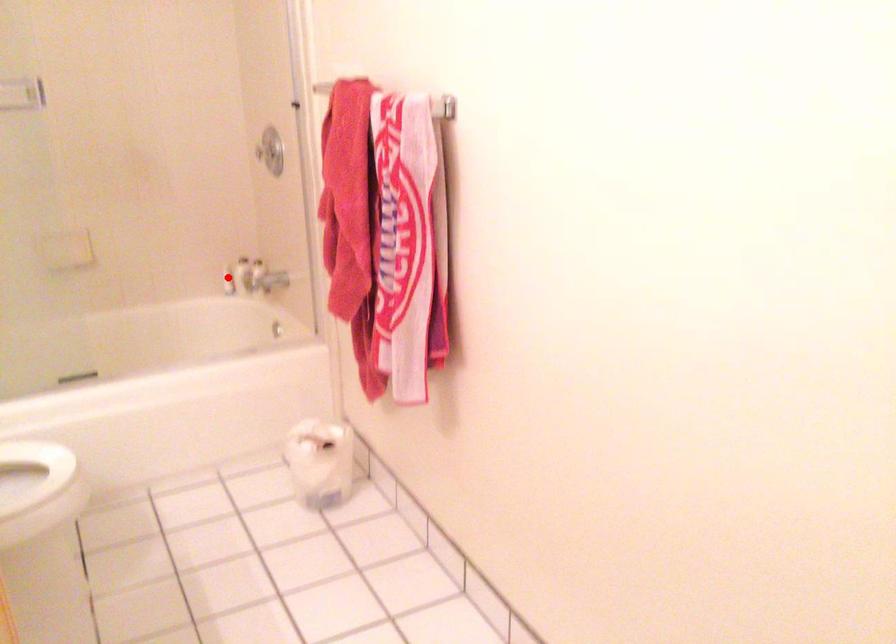
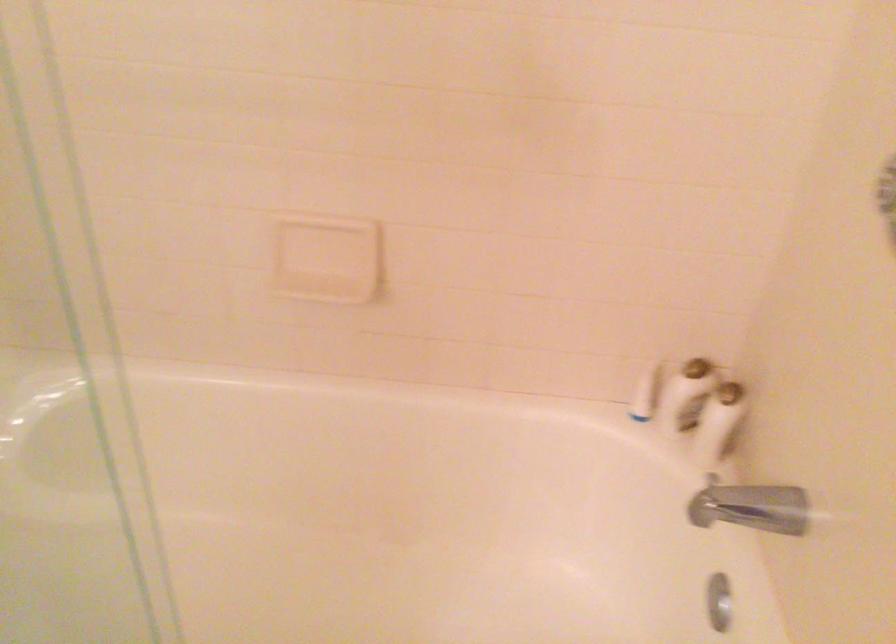
Question: I am providing you with two images of the same scene from different viewpoints. In image1, a red point is highlighted. Considering the same 3D point in image2, which of the following is correct?

Choices:
 (A) It is closer
 (B) It is farther

Answer: (A)